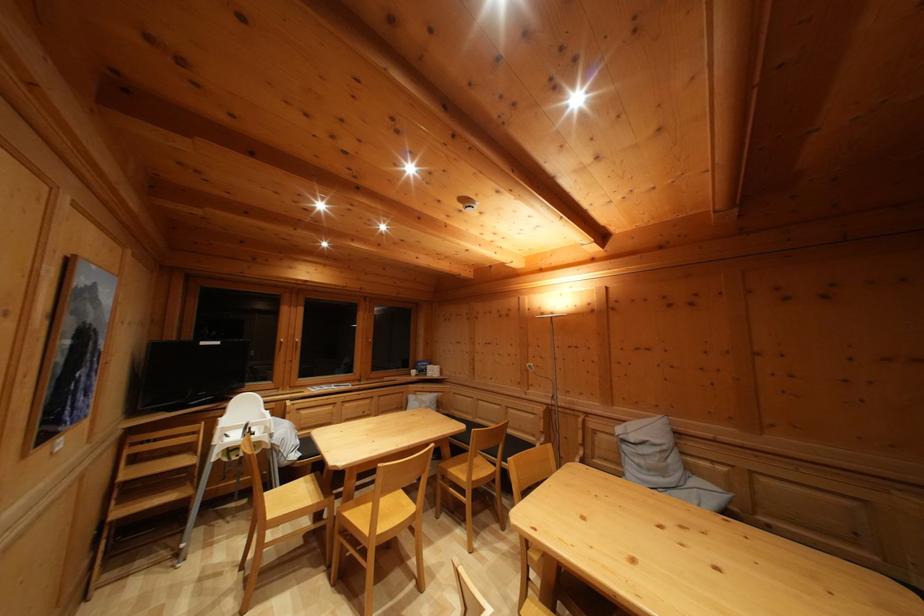
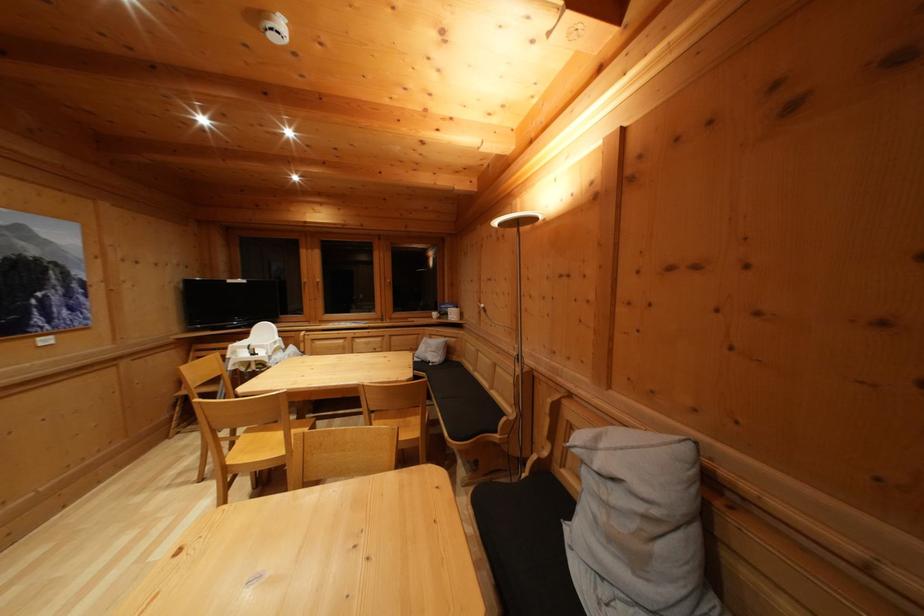
In the second image, find the point that corresponds to pixel 667 477 in the first image.

(640, 565)